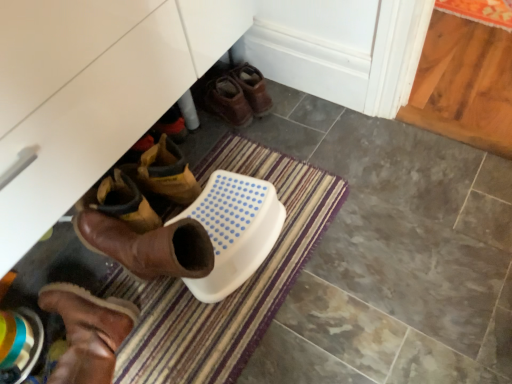
Where is `vacant point to the right of brown leather boots at center, the 2th footwear when ordered from left to right`? The height and width of the screenshot is (384, 512). vacant point to the right of brown leather boots at center, the 2th footwear when ordered from left to right is located at coordinates (292, 100).